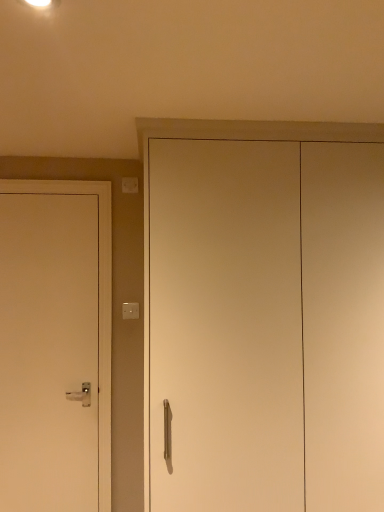
Looking at this image, what is the approximate width of white plastic light switch at upper left, acting as the 2th light switch starting from the bottom?

white plastic light switch at upper left, acting as the 2th light switch starting from the bottom, is 2.65 centimeters in width.

Consider the image. In order to face white plastic light switch at upper left, the first light switch from the top, should I rotate leftwards or rightwards?

To face it directly, rotate left by 8.627 degrees.

Describe the element at coordinates (48, 352) in the screenshot. I see `white matte door at left, acting as the 2th door starting from the front` at that location.

This screenshot has width=384, height=512. What do you see at coordinates (225, 326) in the screenshot?
I see `white matte cabinet at center, which is counted as the first door, starting from the front` at bounding box center [225, 326].

Where is `white matte cabinet at center, which is the first door in right-to-left order`? This screenshot has width=384, height=512. white matte cabinet at center, which is the first door in right-to-left order is located at coordinates (225, 326).

Identify the location of white plastic light switch at upper left, acting as the 2th light switch starting from the bottom. This screenshot has width=384, height=512. pyautogui.click(x=130, y=185).

At what (x,y) coordinates should I click in order to perform the action: click on light switch located underneath the white plastic light switch at upper left, the first light switch from the top (from a real-world perspective). Please return your answer as a coordinate pair (x, y). Image resolution: width=384 pixels, height=512 pixels. Looking at the image, I should click on (130, 311).

From a real-world perspective, does white plastic light switch at upper left, acting as the 2th light switch starting from the bottom, sit lower than white plastic light switch at upper center, the first light switch ordered from the bottom?

Incorrect, from a real-world perspective, white plastic light switch at upper left, acting as the 2th light switch starting from the bottom, is higher than white plastic light switch at upper center, the first light switch ordered from the bottom.

Does white plastic light switch at upper left, acting as the 2th light switch starting from the bottom, have a lesser width compared to white plastic light switch at upper center, the first light switch ordered from the bottom?

No, white plastic light switch at upper left, acting as the 2th light switch starting from the bottom, is not thinner than white plastic light switch at upper center, the first light switch ordered from the bottom.

From a real-world perspective, is white plastic light switch at upper center, the first light switch ordered from the bottom, positioned over white matte door at left, acting as the 2th door starting from the front, based on gravity?

Indeed, from a real-world perspective, white plastic light switch at upper center, the first light switch ordered from the bottom, stands above white matte door at left, acting as the 2th door starting from the front.

Is white plastic light switch at upper center, the first light switch ordered from the bottom, closer to camera compared to white matte door at left, acting as the 2th door starting from the front?

No, white plastic light switch at upper center, the first light switch ordered from the bottom, is further to the viewer.

How much distance is there between white plastic light switch at upper center, arranged as the 2th light switch when viewed from the top, and white matte door at left, acting as the 2th door starting from the front?

The distance of white plastic light switch at upper center, arranged as the 2th light switch when viewed from the top, from white matte door at left, acting as the 2th door starting from the front, is 21.50 inches.

Would you say white plastic light switch at upper center, arranged as the 2th light switch when viewed from the top, is outside white matte door at left, which ranks as the 2th door in right-to-left order?

Absolutely, white plastic light switch at upper center, arranged as the 2th light switch when viewed from the top, is external to white matte door at left, which ranks as the 2th door in right-to-left order.

Is white matte cabinet at center, which is counted as the second door, starting from the back, wider than white matte door at left, which is the first door in left-to-right order?

Correct, the width of white matte cabinet at center, which is counted as the second door, starting from the back, exceeds that of white matte door at left, which is the first door in left-to-right order.

From their relative heights in the image, would you say white matte cabinet at center, arranged as the second door when viewed from the left, is taller or shorter than white matte door at left, which ranks as the 2th door in right-to-left order?

In the image, white matte cabinet at center, arranged as the second door when viewed from the left, appears to be taller than white matte door at left, which ranks as the 2th door in right-to-left order.

Is white matte cabinet at center, arranged as the second door when viewed from the left, positioned with its back to white matte door at left, which is the first door in left-to-right order?

That's not correct — white matte cabinet at center, arranged as the second door when viewed from the left, is not looking away from white matte door at left, which is the first door in left-to-right order.

Looking at the image, does white matte cabinet at center, arranged as the second door when viewed from the left, seem bigger or smaller compared to white matte door at left, which ranks as the 2th door in right-to-left order?

Considering their sizes, white matte cabinet at center, arranged as the second door when viewed from the left, takes up more space than white matte door at left, which ranks as the 2th door in right-to-left order.

Which of these two, white matte door at left, which is the first door in left-to-right order, or white plastic light switch at upper center, arranged as the 2th light switch when viewed from the top, is thinner?

With smaller width is white plastic light switch at upper center, arranged as the 2th light switch when viewed from the top.

Is white plastic light switch at upper center, the first light switch ordered from the bottom, completely or partially inside white matte door at left, which ranks as the 2th door in right-to-left order?

No.

From a real-world perspective, who is located lower, white matte door at left, which is counted as the first door, starting from the back, or white plastic light switch at upper center, the first light switch ordered from the bottom?

In real-world perspective, white matte door at left, which is counted as the first door, starting from the back, is lower.

What's the angular difference between white matte door at left, which ranks as the 2th door in right-to-left order, and white plastic light switch at upper center, arranged as the 2th light switch when viewed from the top,'s facing directions?

They differ by 0.0134 degrees in their facing directions.

Does white matte door at left, which is the first door in left-to-right order, turn towards white plastic light switch at upper left, acting as the 2th light switch starting from the bottom?

No, white matte door at left, which is the first door in left-to-right order, is not oriented towards white plastic light switch at upper left, acting as the 2th light switch starting from the bottom.

From the image's perspective, which door is the 2nd one below the white plastic light switch at upper left, the first light switch from the top? Please provide its 2D coordinates.

[(48, 352)]

Does white matte door at left, which ranks as the 2th door in right-to-left order, have a greater width compared to white plastic light switch at upper left, the first light switch from the top?

Yes.

From the image's perspective, which one is positioned lower, white matte door at left, which is counted as the first door, starting from the back, or white plastic light switch at upper left, acting as the 2th light switch starting from the bottom?

white matte door at left, which is counted as the first door, starting from the back, appears lower in the image.

What are the coordinates of `the 1st light switch behind the white matte cabinet at center, which is the first door in right-to-left order` in the screenshot? It's located at (130, 311).

Is white matte cabinet at center, which is counted as the first door, starting from the front, outside of white plastic light switch at upper center, the first light switch ordered from the bottom?

That's correct, white matte cabinet at center, which is counted as the first door, starting from the front, is outside of white plastic light switch at upper center, the first light switch ordered from the bottom.

Is white matte cabinet at center, which is the first door in right-to-left order, oriented away from white plastic light switch at upper center, the first light switch ordered from the bottom?

No, white matte cabinet at center, which is the first door in right-to-left order, is not facing away from white plastic light switch at upper center, the first light switch ordered from the bottom.

Which is more to the right, white plastic light switch at upper center, the first light switch ordered from the bottom, or white matte cabinet at center, which is counted as the second door, starting from the back?

white matte cabinet at center, which is counted as the second door, starting from the back.

Starting from the white plastic light switch at upper center, the first light switch ordered from the bottom, which door is the 2nd one in front? Please provide its 2D coordinates.

[(225, 326)]

Is white plastic light switch at upper center, the first light switch ordered from the bottom, inside the boundaries of white matte cabinet at center, which is the first door in right-to-left order, or outside?

white plastic light switch at upper center, the first light switch ordered from the bottom, is not inside white matte cabinet at center, which is the first door in right-to-left order, it's outside.

From the picture: From the image's perspective, is white plastic light switch at upper center, arranged as the 2th light switch when viewed from the top, located beneath white matte cabinet at center, which is the first door in right-to-left order?

No, from the image's perspective, white plastic light switch at upper center, arranged as the 2th light switch when viewed from the top, is not below white matte cabinet at center, which is the first door in right-to-left order.

Locate an element on the screen. light switch directly beneath the white plastic light switch at upper left, the first light switch from the top (from a real-world perspective) is located at coordinates (130, 311).

Where is `the 1st light switch behind the white matte door at left, which is the first door in left-to-right order`? The width and height of the screenshot is (384, 512). the 1st light switch behind the white matte door at left, which is the first door in left-to-right order is located at coordinates (130, 311).

Estimate the real-world distances between objects in this image. Which object is further from white plastic light switch at upper center, arranged as the 2th light switch when viewed from the top, white matte door at left, which is counted as the first door, starting from the back, or white plastic light switch at upper left, acting as the 2th light switch starting from the bottom?

Based on the image, white plastic light switch at upper left, acting as the 2th light switch starting from the bottom, appears to be further to white plastic light switch at upper center, arranged as the 2th light switch when viewed from the top.

Looking at the image, which one is located closer to white matte cabinet at center, which is counted as the first door, starting from the front, white plastic light switch at upper left, acting as the 2th light switch starting from the bottom, or white plastic light switch at upper center, the first light switch ordered from the bottom?

Among the two, white plastic light switch at upper center, the first light switch ordered from the bottom, is located nearer to white matte cabinet at center, which is counted as the first door, starting from the front.

From the image, which object appears to be farther from white plastic light switch at upper center, the first light switch ordered from the bottom, white plastic light switch at upper left, the first light switch from the top, or white matte cabinet at center, arranged as the second door when viewed from the left?

white matte cabinet at center, arranged as the second door when viewed from the left, lies further to white plastic light switch at upper center, the first light switch ordered from the bottom, than the other object.

Estimate the real-world distances between objects in this image. Which object is closer to white plastic light switch at upper left, the first light switch from the top, white matte door at left, which is the first door in left-to-right order, or white matte cabinet at center, which is counted as the second door, starting from the back?

white matte door at left, which is the first door in left-to-right order, lies closer to white plastic light switch at upper left, the first light switch from the top, than the other object.

When comparing their distances from white matte door at left, which ranks as the 2th door in right-to-left order, does white matte cabinet at center, which is the first door in right-to-left order, or white plastic light switch at upper center, arranged as the 2th light switch when viewed from the top, seem further?

white matte cabinet at center, which is the first door in right-to-left order, is positioned further to the anchor white matte door at left, which ranks as the 2th door in right-to-left order.

When comparing their distances from white matte door at left, which is the first door in left-to-right order, does white plastic light switch at upper left, acting as the 2th light switch starting from the bottom, or white plastic light switch at upper center, the first light switch ordered from the bottom, seem further?

white plastic light switch at upper left, acting as the 2th light switch starting from the bottom, lies further to white matte door at left, which is the first door in left-to-right order, than the other object.

Estimate the real-world distances between objects in this image. Which object is closer to white matte door at left, which is the first door in left-to-right order, white plastic light switch at upper left, acting as the 2th light switch starting from the bottom, or white matte cabinet at center, which is the first door in right-to-left order?

white matte cabinet at center, which is the first door in right-to-left order.

Looking at the image, which one is located further to white plastic light switch at upper left, acting as the 2th light switch starting from the bottom, white matte door at left, acting as the 2th door starting from the front, or white plastic light switch at upper center, arranged as the 2th light switch when viewed from the top?

white matte door at left, acting as the 2th door starting from the front, is positioned further to the anchor white plastic light switch at upper left, acting as the 2th light switch starting from the bottom.

Locate an element on the screen. This screenshot has height=512, width=384. light switch between white plastic light switch at upper left, the first light switch from the top, and white matte door at left, which is the first door in left-to-right order, in the vertical direction is located at coordinates (130, 311).

Locate an element on the screen. light switch between white plastic light switch at upper left, the first light switch from the top, and white matte cabinet at center, which is counted as the second door, starting from the back is located at coordinates (130, 311).